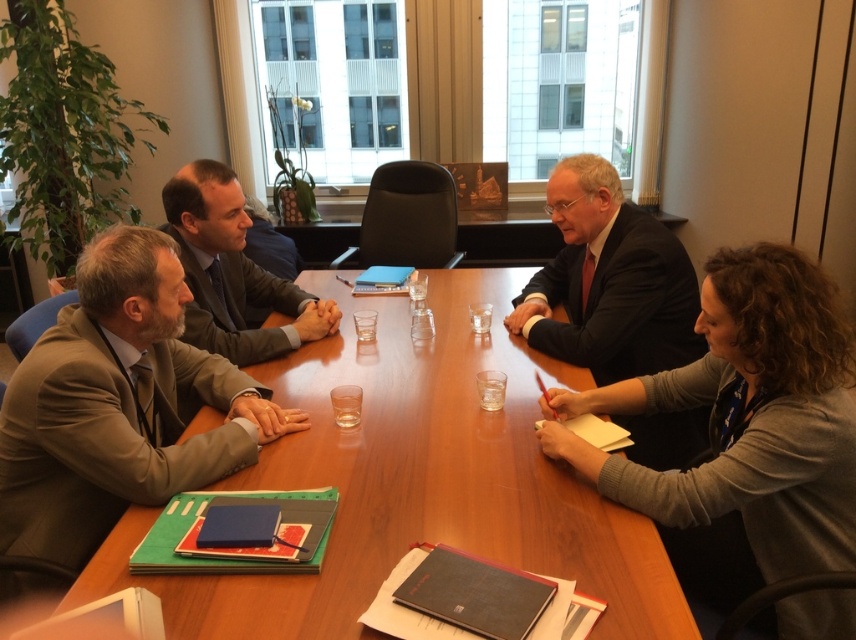
Question: Does wooden table at center appear under gray fabric sweater at lower right?

Choices:
 (A) no
 (B) yes

Answer: (A)

Question: Which object appears closest to the camera in this image?

Choices:
 (A) matte brown suit at left
 (B) matte gray suit at center

Answer: (A)

Question: Is wooden table at center below matte gray suit at center?

Choices:
 (A) yes
 (B) no

Answer: (A)

Question: Is gray fabric sweater at lower right wider than dark suit at center?

Choices:
 (A) yes
 (B) no

Answer: (A)

Question: Which point is farther to the camera?

Choices:
 (A) dark suit at center
 (B) matte brown suit at left
 (C) matte gray suit at center

Answer: (C)

Question: Which point is farther to the camera?

Choices:
 (A) (218, 227)
 (B) (168, 381)
 (C) (786, 493)

Answer: (A)